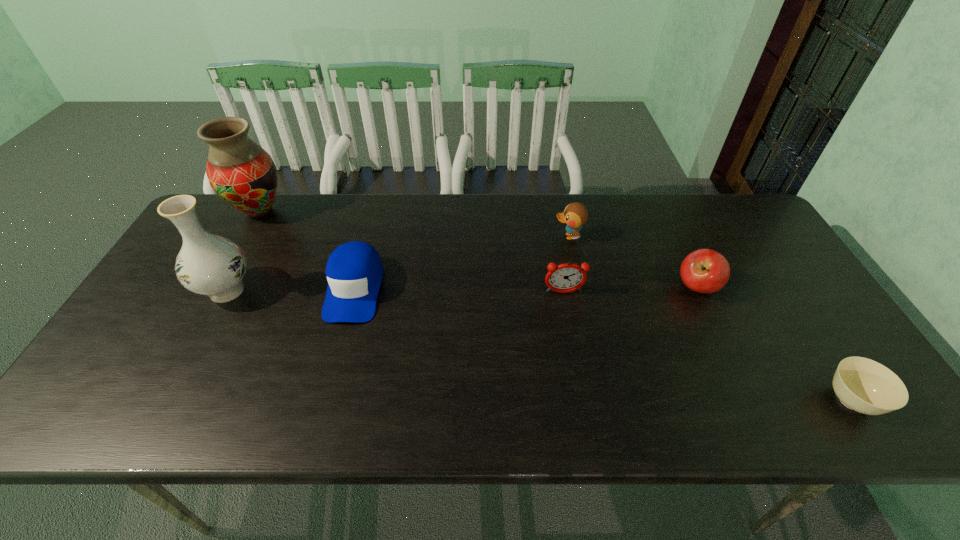
Where is `the farther vase`? This screenshot has width=960, height=540. the farther vase is located at coordinates (243, 174).

Where is `the nearer vase`? the nearer vase is located at coordinates (207, 264).

Find the location of a particular element. duck is located at coordinates (575, 215).

This screenshot has height=540, width=960. In order to click on the sixth object from left to right in this screenshot , I will do `click(705, 270)`.

Where is `alarm clock`? The image size is (960, 540). alarm clock is located at coordinates pos(564,278).

Locate an element on the screen. baseball cap is located at coordinates (354, 271).

Locate an element on the screen. The image size is (960, 540). sugar bowl is located at coordinates (861, 384).

Identify the location of the nearest object. The image size is (960, 540). (861, 384).

Where is `vacant area located on the front of the farther vase`? This screenshot has height=540, width=960. vacant area located on the front of the farther vase is located at coordinates (198, 321).

Where is `free space located 0.130m on the front of the nearer vase`? This screenshot has height=540, width=960. free space located 0.130m on the front of the nearer vase is located at coordinates (192, 356).